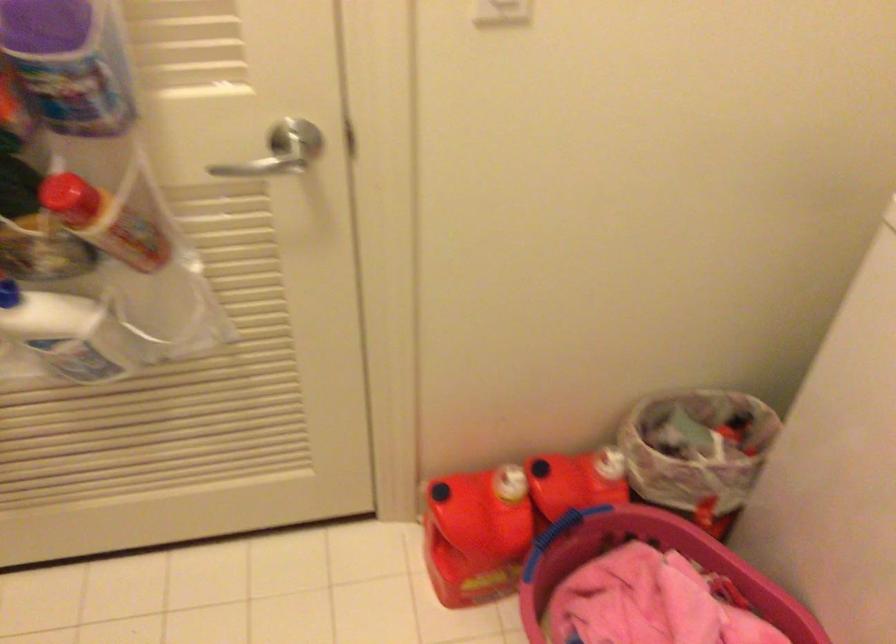
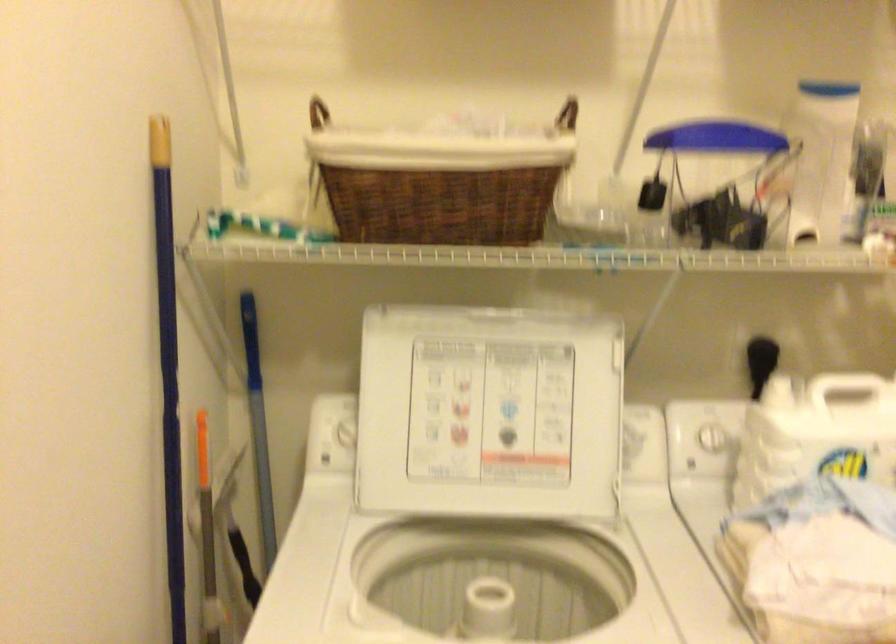
Question: The camera is either moving clockwise (left) or counter-clockwise (right) around the object. The first image is from the beginning of the video and the second image is from the end. Is the camera moving left or right when shooting the video?

Choices:
 (A) Left
 (B) Right

Answer: (A)